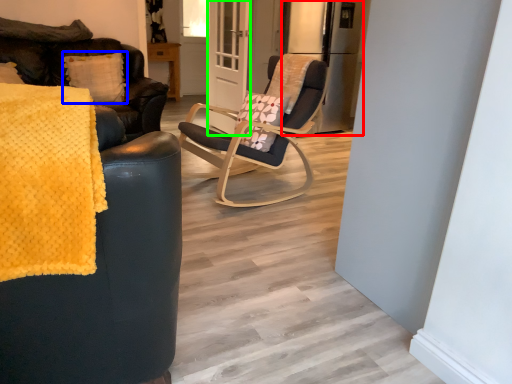
Question: Which object is the farthest from appliance (highlighted by a red box)? Choose among these: pillow (highlighted by a blue box) or screen door (highlighted by a green box).

Choices:
 (A) pillow
 (B) screen door

Answer: (A)